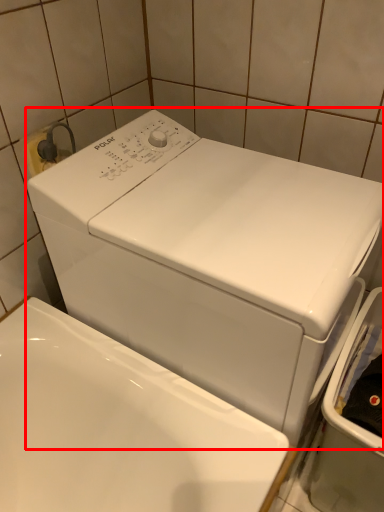
Question: Considering the relative positions of washing machine (annotated by the red box) and dish washer in the image provided, where is washing machine (annotated by the red box) located with respect to the staircase?

Choices:
 (A) right
 (B) left

Answer: (B)